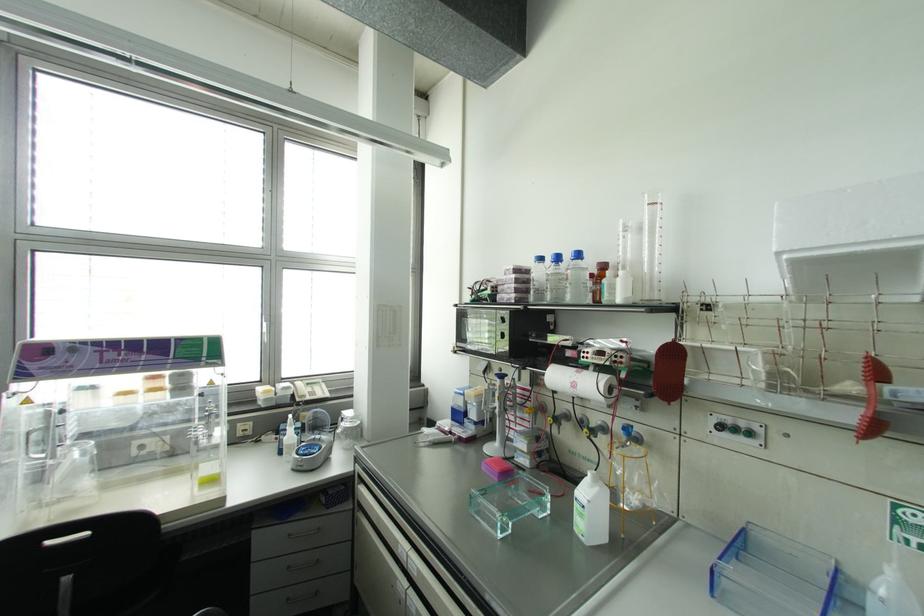
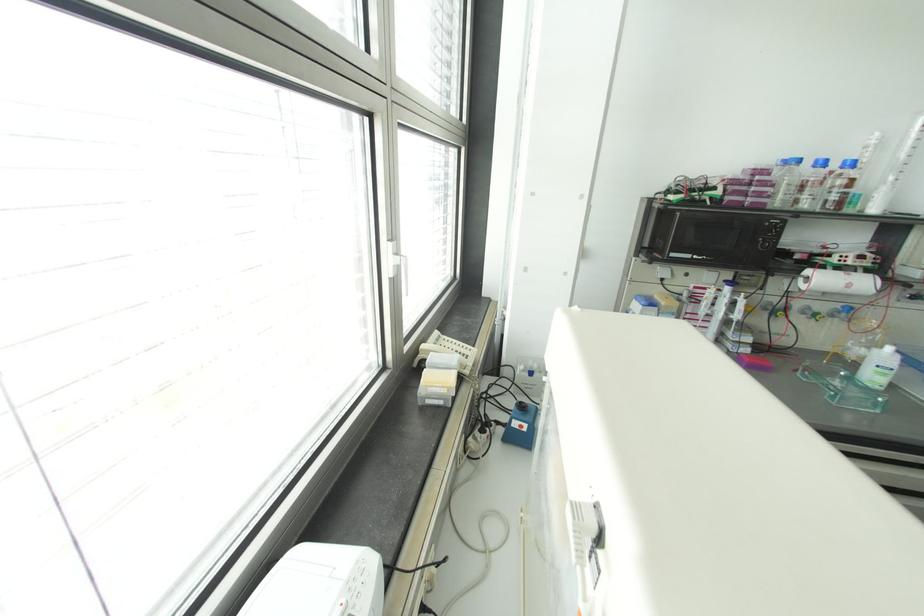
Find the pixel in the second image that matches (540,257) in the first image.

(797, 160)